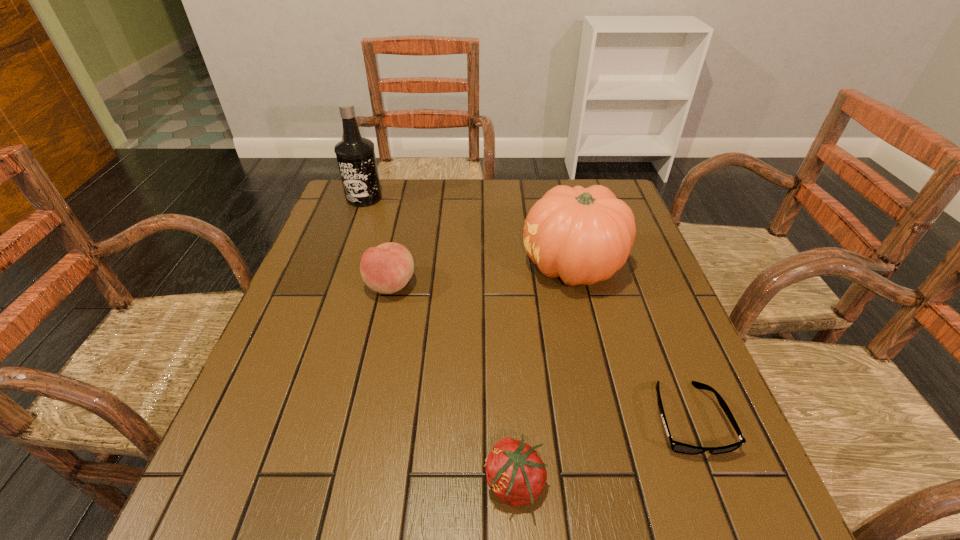
At what (x,y) coordinates should I click in order to perform the action: click on vacant space situated on the carved face of the second tallest object. Please return your answer as a coordinate pair (x, y). Looking at the image, I should click on (501, 266).

The height and width of the screenshot is (540, 960). In order to click on free spot located 0.280m on the back of the third shortest object in this screenshot , I will do `click(408, 207)`.

The image size is (960, 540). In order to click on blank area located 0.330m on the right of the second shortest object in this screenshot , I will do `click(747, 484)`.

Find the location of a particular element. This screenshot has height=540, width=960. free space located on the front-facing side of the shortest object is located at coordinates (731, 530).

Image resolution: width=960 pixels, height=540 pixels. What are the coordinates of `object at the far edge` in the screenshot? It's located at (355, 155).

Where is `object that is at the near edge`? object that is at the near edge is located at coordinates (515, 473).

The width and height of the screenshot is (960, 540). I want to click on object present at the left edge, so click(355, 155).

Identify the location of pumpkin located at the right edge. This screenshot has width=960, height=540. (583, 235).

This screenshot has height=540, width=960. In order to click on sunglasses that is positioned at the right edge in this screenshot , I will do `click(678, 447)`.

I want to click on object at the far left corner, so click(355, 155).